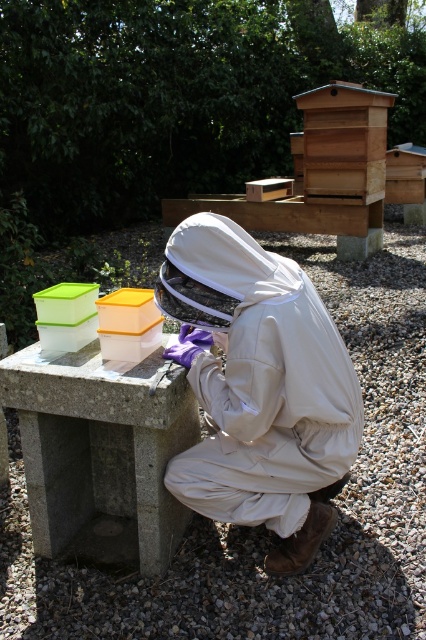
Question: Which of the following is the farthest from the observer?

Choices:
 (A) white fabric beekeeper suit at center
 (B) wooden beehive at upper center

Answer: (B)

Question: Which point is farther to the camera?

Choices:
 (A) white fabric beekeeper suit at center
 (B) concrete table at center

Answer: (B)

Question: Estimate the real-world distances between objects in this image. Which object is closer to the white fabric beekeeper suit at center?

Choices:
 (A) concrete table at center
 (B) wooden beehive at upper center

Answer: (A)

Question: Does white fabric beekeeper suit at center have a larger size compared to wooden beehive at upper center?

Choices:
 (A) no
 (B) yes

Answer: (A)

Question: Can you confirm if white fabric beekeeper suit at center is positioned above concrete table at center?

Choices:
 (A) no
 (B) yes

Answer: (B)

Question: Can you confirm if concrete table at center is positioned to the right of wooden beehive at upper center?

Choices:
 (A) no
 (B) yes

Answer: (A)